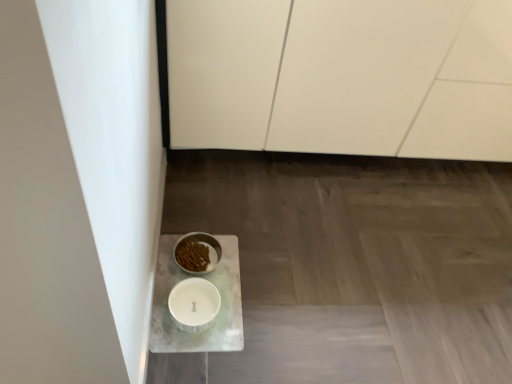
Locate an element on the screen. This screenshot has width=512, height=384. vacant space to the right of white glossy bowl at lower left, arranged as the first tableware when viewed from the top is located at coordinates (256, 261).